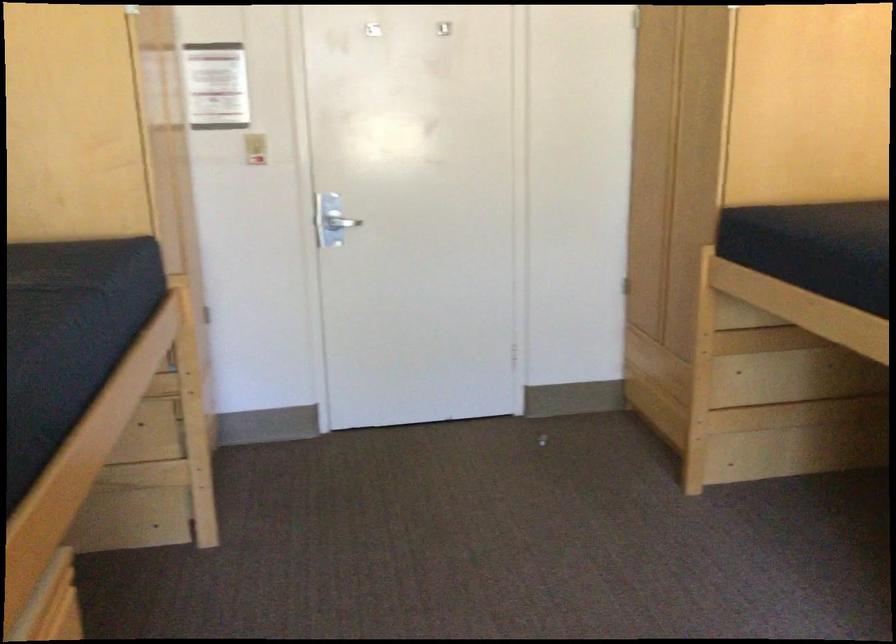
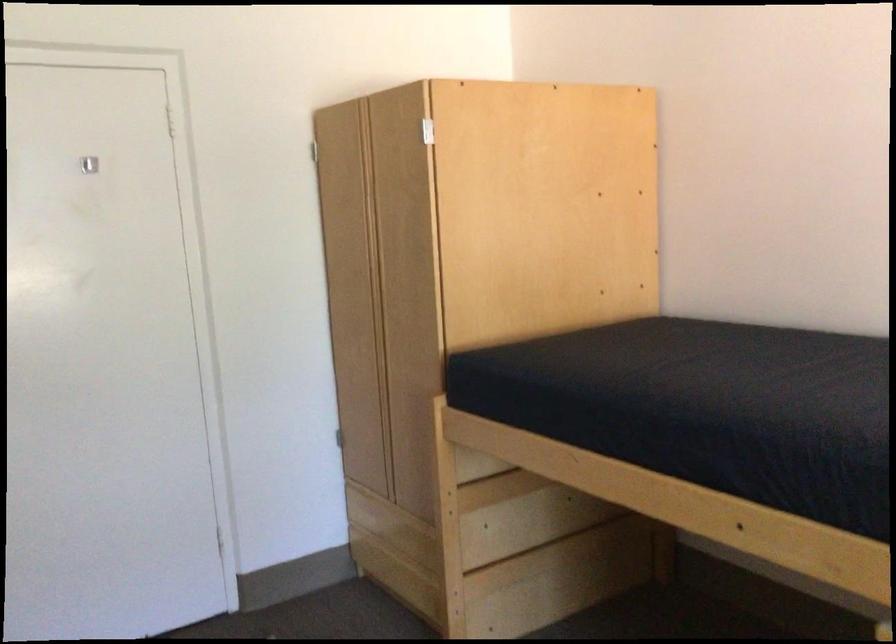
Question: How did the camera likely rotate?

Choices:
 (A) Left
 (B) Right
 (C) Up
 (D) Down

Answer: (B)